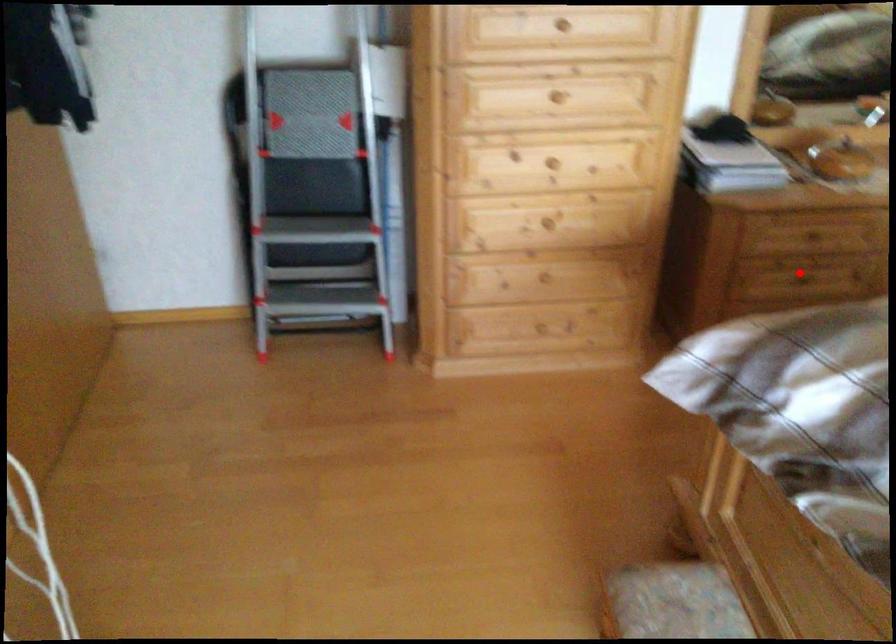
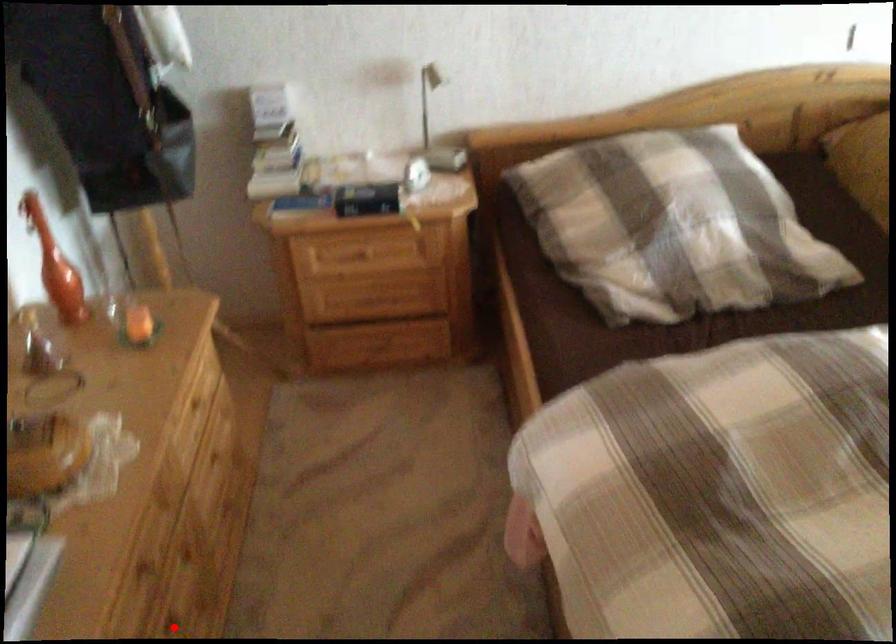
I am providing you with two images of the same scene from different viewpoints. A red point is marked on the first image and another point is marked on the second image. Is the red point in image1 aligned with the point shown in image2?

Yes